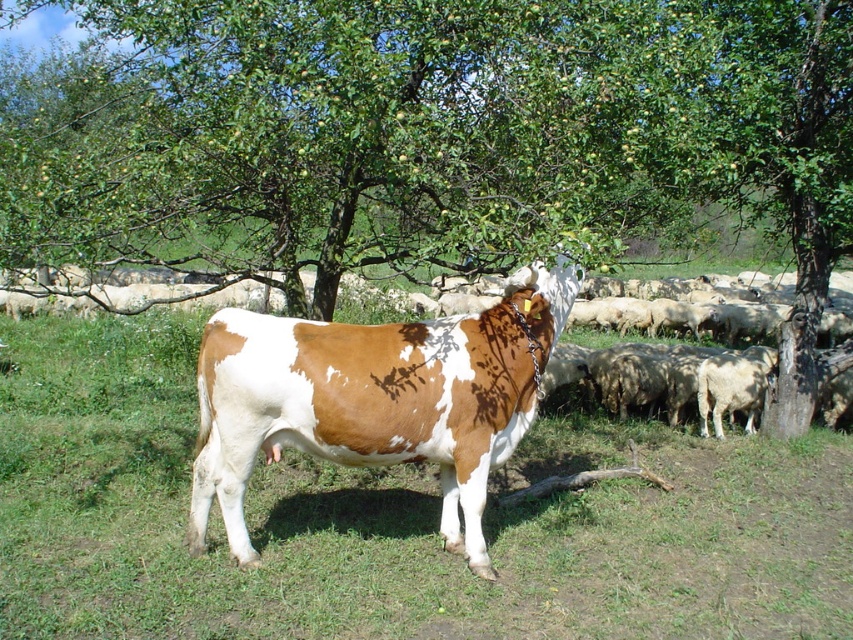
Between point (428, 51) and point (482, 460), which one is positioned in front?

Positioned in front is point (428, 51).

Between point (558, 205) and point (474, 557), which one is positioned in front?

Positioned in front is point (558, 205).

The width and height of the screenshot is (853, 640). In order to click on green leafy tree at center in this screenshot , I will do `click(459, 138)`.